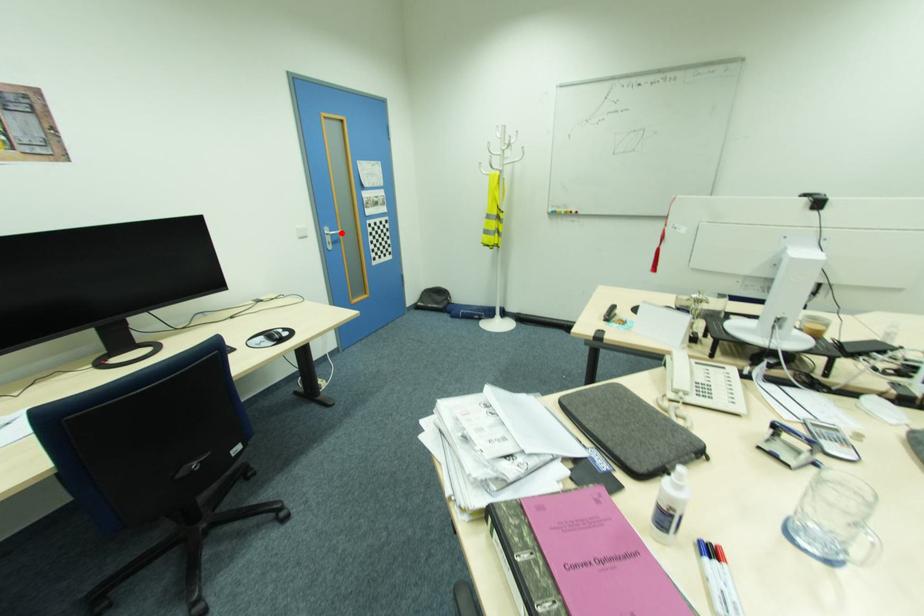
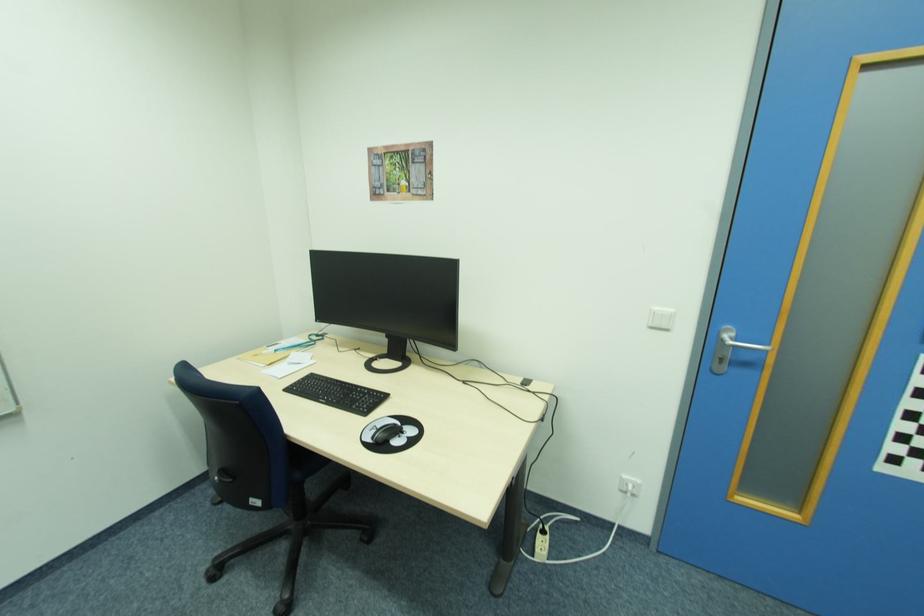
In the second image, find the point that corresponds to the highlighted location in the first image.

(768, 350)